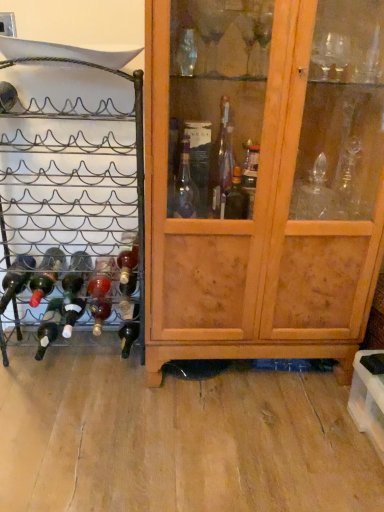
What are the coordinates of `empty space that is in between dark glass bottle at lower left, the second bottle in the right-to-left sequence, and matte dark brown bottle at lower left, which is the sixth bottle from right to left` in the screenshot? It's located at (94, 354).